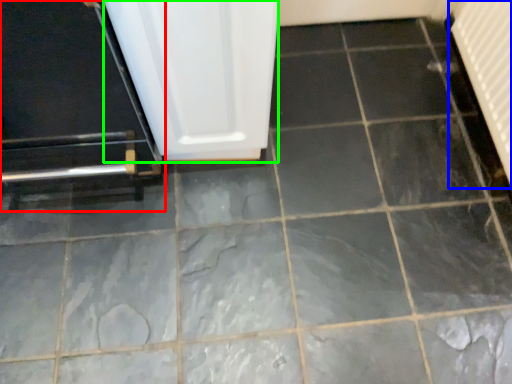
Question: Which is nearer to the door (highlighted by a red box)? radiator (highlighted by a blue box) or screen door (highlighted by a green box).

Choices:
 (A) radiator
 (B) screen door

Answer: (B)